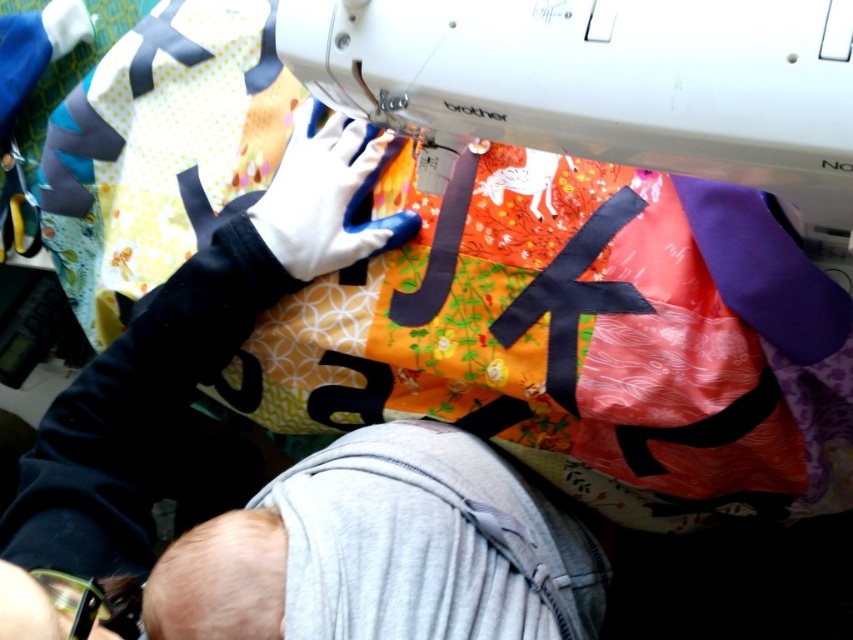
You are a delivery robot with a height of 40 centimeters. You need to deliver a package to the gray soft baby at lower center. The path to the baby is blocked by the white plastic sewing machine at upper center. Can you lower the sewing machine to create enough space to pass?

The distance between the white plastic sewing machine at upper center and the gray soft baby at lower center is 38.81 centimeters. Since the robot is 40 centimeters tall, lowering the sewing machine would not help as the issue is vertical clearance, not horizontal distance. The robot cannot pass because it is taller than the available vertical space.

You are trying to determine if there is enough space to place a new fabric roll next to the white plastic sewing machine at upper center and the gray soft baby at lower center. Based on their sizes, can you fit the fabric roll between them?

The white plastic sewing machine at upper center occupies less space than gray soft baby at lower center. Since the sewing machine is smaller, there might be enough space between them to place the fabric roll, but it depends on the exact dimensions of the fabric roll and the available space between the two objects.

You are a sewing enthusiast who wants to place a 10cm tall fabric box on the sewing table. The white plastic sewing machine at upper center and the gray soft baby at lower center are already on the table. Can you place the fabric box between them without moving the existing items?

The white plastic sewing machine at upper center has a lesser height compared to gray soft baby at lower center. Since the fabric box is only 10cm tall, it can be placed between them as long as there is enough horizontal space between the two objects. The height difference between the sewing machine and the baby does not affect the placement of the fabric box.